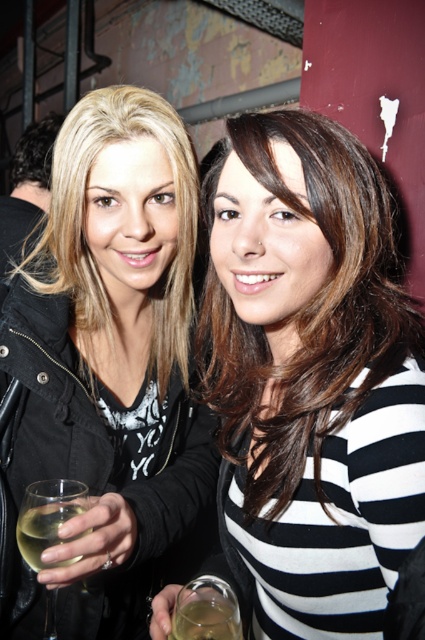
Question: In this image, where is black striped shirt at center located relative to dark brown hair at upper left?

Choices:
 (A) above
 (B) below

Answer: (B)

Question: Which point is closer to the camera?

Choices:
 (A) (289, 160)
 (B) (22, 525)
 (C) (209, 625)

Answer: (C)

Question: Which is nearer to the matte black jacket at center?

Choices:
 (A) translucent glass wine at center
 (B) translucent glass at hand right

Answer: (B)

Question: Estimate the real-world distances between objects in this image. Which object is closer to the clear glass wine glass at lower left?

Choices:
 (A) black striped shirt at center
 (B) translucent glass at hand right
 (C) translucent glass wine at center
 (D) dark brown hair at upper left

Answer: (B)

Question: Does black striped shirt at center appear on the left side of matte black jacket at center?

Choices:
 (A) no
 (B) yes

Answer: (A)

Question: Is matte black jacket at center further to camera compared to clear glass wine glass at lower left?

Choices:
 (A) yes
 (B) no

Answer: (B)